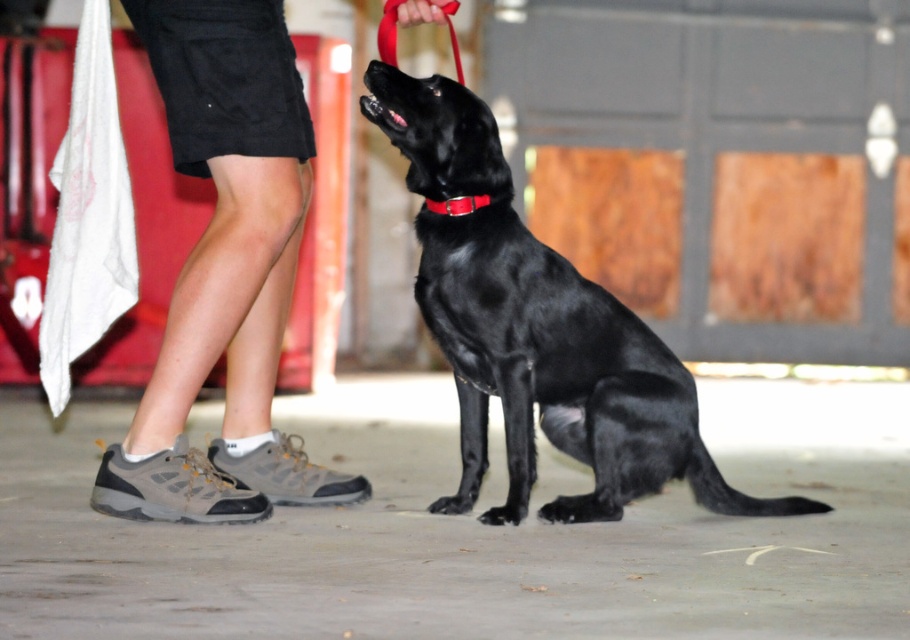
Question: Which object is closer to the camera taking this photo?

Choices:
 (A) shiny black dog at center
 (B) red leather collar at center
 (C) gray fabric shoe at lower left
 (D) red fabric leash at upper center

Answer: (C)

Question: Is shiny black dog at center closer to camera compared to gray fabric shoe at lower left?

Choices:
 (A) no
 (B) yes

Answer: (A)

Question: Which of the following is the closest to the observer?

Choices:
 (A) red leather collar at center
 (B) shiny black dog at center
 (C) red fabric leash at upper center

Answer: (C)

Question: Which point is closer to the camera?

Choices:
 (A) gray fabric shoe at lower left
 (B) red fabric leash at upper center

Answer: (A)

Question: Can you confirm if shiny black dog at center is smaller than red fabric leash at upper center?

Choices:
 (A) no
 (B) yes

Answer: (A)

Question: From the image, what is the correct spatial relationship of red fabric leash at upper center in relation to red leather collar at center?

Choices:
 (A) below
 (B) above

Answer: (B)